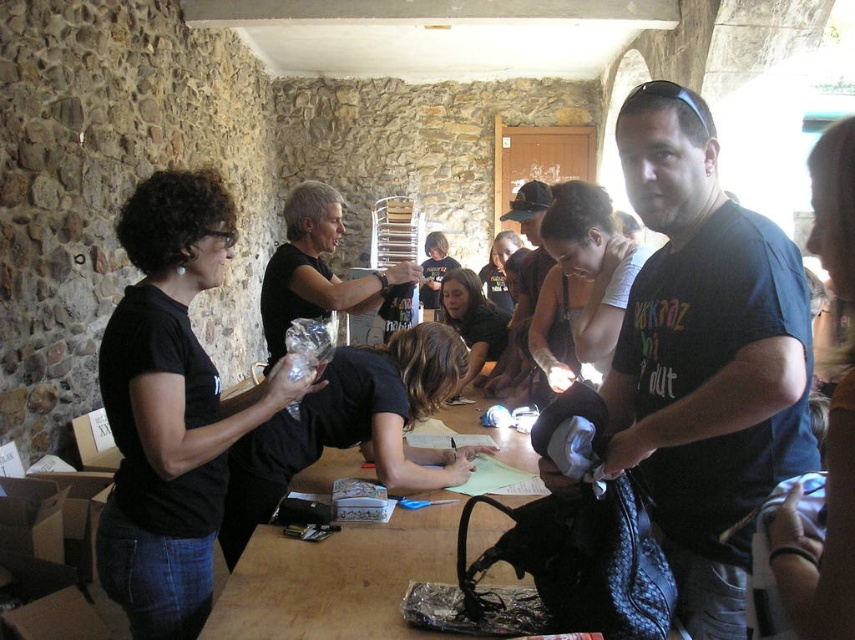
You are standing at the entrance of the rustic stone room and see two points on the table. The first point is at coordinates point (679, 502) and the second is at point (311, 289). If you want to reach the point that is closer to you, which coordinate should you head towards?

Point (311, 289) is closer to you because it is behind point (679, 502). Since point (679, 502) is in front of point (311, 289), the latter is farther away from your position at the entrance.